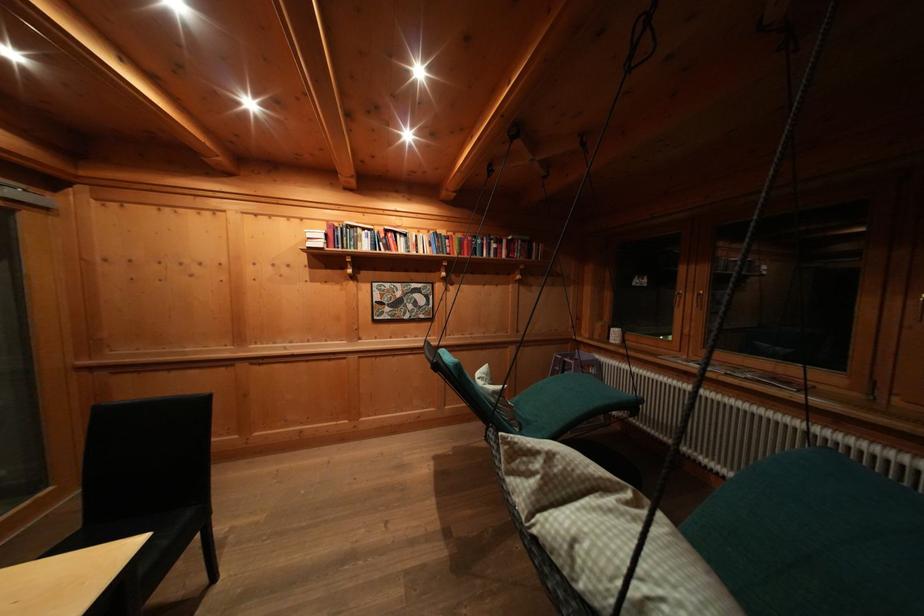
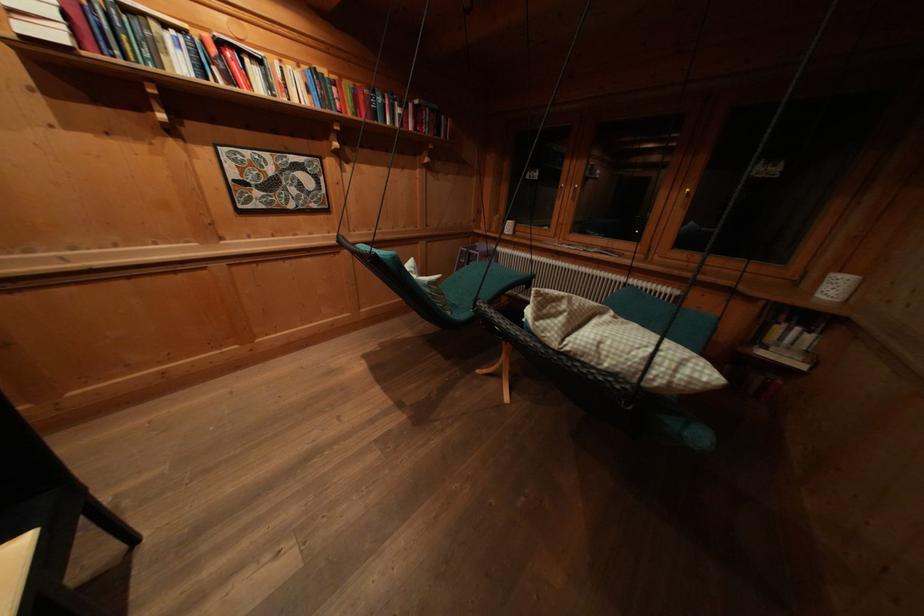
Where in the second image is the point corresponding to (485,246) from the first image?

(385, 103)